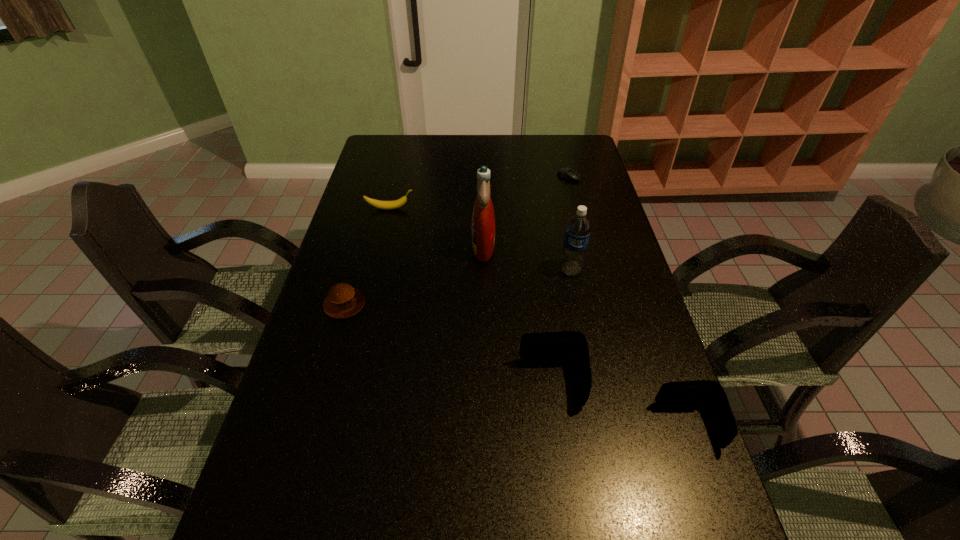
This screenshot has width=960, height=540. Identify the location of vacant region between the muffin and the computer mouse. 457,240.

This screenshot has height=540, width=960. I want to click on free spot between the second shortest object and the detergent, so click(x=414, y=275).

Locate an element on the screen. free space between the taller wallet and the banana is located at coordinates (471, 295).

Find the location of a particular element. vacant region between the shortest object and the detergent is located at coordinates click(526, 212).

Locate an element on the screen. free space between the computer mouse and the taller wallet is located at coordinates (561, 280).

I want to click on object that is the nearest to the sixth nearest object, so click(483, 219).

Locate which object is the third closest to the banana. Please provide its 2D coordinates. Your answer should be formatted as a tuple, i.e. [(x, y)], where the tuple contains the x and y coordinates of a point satisfying the conditions above.

[(578, 228)]

Find the location of a particular element. This screenshot has height=540, width=960. vacant space that satisfies the following two spatial constraints: 1. at the stem of the banana; 2. on the right side of the second tallest object is located at coordinates (375, 270).

In order to click on vacant space that satisfies the following two spatial constraints: 1. on the back side of the fifth farthest object; 2. on the right side of the water bottle in this screenshot , I will do `click(354, 270)`.

You are a GUI agent. You are given a task and a screenshot of the screen. Output one action in this format:
    pyautogui.click(x=<x>, y=<y>)
    Task: Click on the free spot that satisfies the following two spatial constraints: 1. at the stem of the water bottle; 2. on the left side of the banana
    The image size is (960, 540).
    Given the screenshot: What is the action you would take?
    pyautogui.click(x=375, y=270)